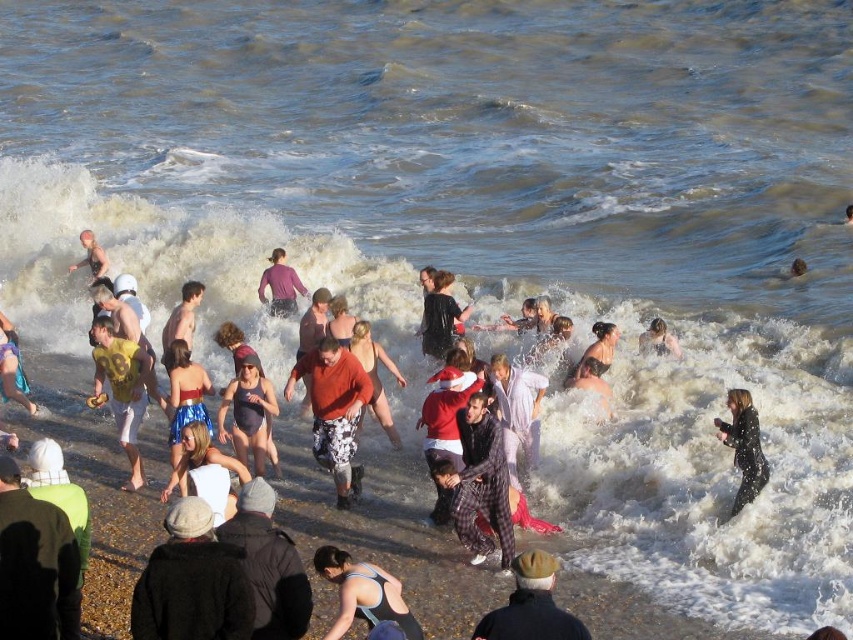
Question: Which object is farther from the camera taking this photo?

Choices:
 (A) blue fabric bikini at center
 (B) orange fabric swimsuit at center

Answer: (B)

Question: Which object is positioned closest to the matte purple shirt at center?

Choices:
 (A) light skin tone flesh at lower left
 (B) dark gray woolen hat at lower left

Answer: (A)

Question: Is plaid pajama pants at center wider than dark brown wool cap at lower center?

Choices:
 (A) no
 (B) yes

Answer: (A)

Question: Is dark gray knit cap at lower left to the right of matte black coat at center from the viewer's perspective?

Choices:
 (A) yes
 (B) no

Answer: (B)

Question: Does matte black swimsuit at lower center appear under smooth skin person at center?

Choices:
 (A) no
 (B) yes

Answer: (B)

Question: Which point appears farthest from the camera in this image?

Choices:
 (A) (103, 282)
 (B) (247, 374)
 (C) (201, 484)

Answer: (A)